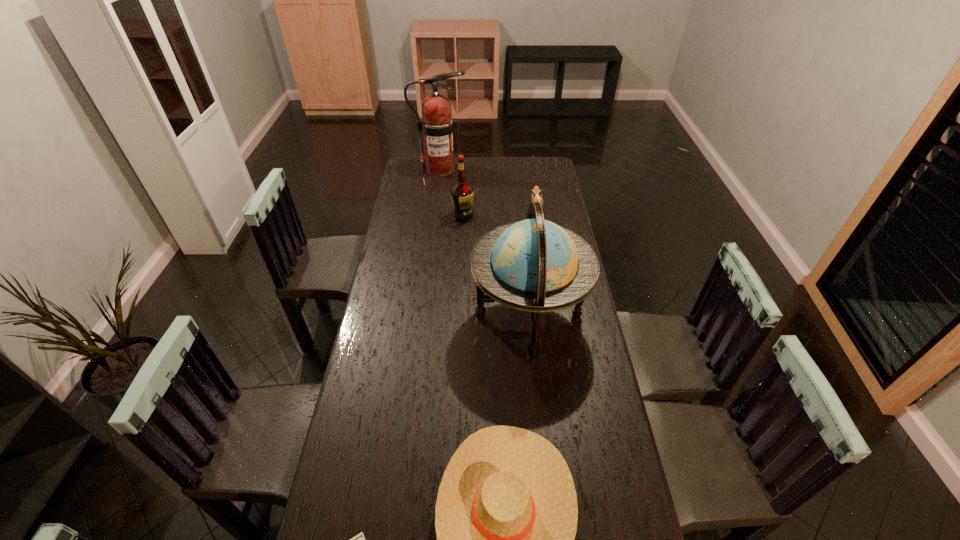
Identify the location of free space located at the beak of the fifth tallest object. Image resolution: width=960 pixels, height=540 pixels. (471, 207).

Image resolution: width=960 pixels, height=540 pixels. Find the location of `free space located 0.050m at the beak of the fifth tallest object`. free space located 0.050m at the beak of the fifth tallest object is located at coordinates (520, 207).

Image resolution: width=960 pixels, height=540 pixels. I want to click on object that is at the far edge, so click(x=437, y=124).

Locate an element on the screen. This screenshot has height=540, width=960. object at the left edge is located at coordinates (437, 124).

I want to click on globe that is at the right edge, so click(x=534, y=265).

The height and width of the screenshot is (540, 960). What are the coordinates of `bird present at the right edge` in the screenshot? It's located at (537, 198).

Where is `object situated at the far left corner`? object situated at the far left corner is located at coordinates (437, 124).

In the image, there is a desktop. Identify the location of free space at the far edge. (505, 162).

This screenshot has width=960, height=540. I want to click on vacant space at the left edge of the desktop, so click(x=418, y=294).

This screenshot has height=540, width=960. Find the location of `free spot at the right edge of the desktop`. free spot at the right edge of the desktop is located at coordinates (575, 346).